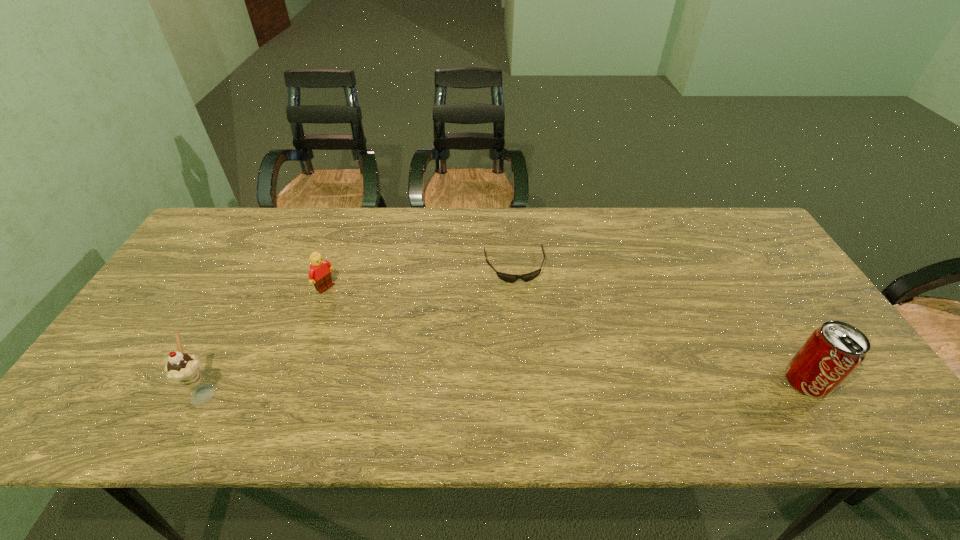
Locate an element on the screen. blank space at the near edge of the desktop is located at coordinates (528, 394).

This screenshot has height=540, width=960. In the image, there is a desktop. Identify the location of free region at the left edge. (154, 336).

The height and width of the screenshot is (540, 960). In order to click on vacant space at the far left corner in this screenshot , I will do `click(232, 241)`.

Locate an element on the screen. This screenshot has width=960, height=540. vacant space at the far right corner of the desktop is located at coordinates (714, 214).

Where is `empty space that is in between the third object from left to right and the rightmost object`? The height and width of the screenshot is (540, 960). empty space that is in between the third object from left to right and the rightmost object is located at coordinates (660, 324).

This screenshot has width=960, height=540. What are the coordinates of `free space between the shortest object and the pop soda` in the screenshot? It's located at (660, 324).

Locate an element on the screen. The width and height of the screenshot is (960, 540). vacant point located between the Lego and the icecream is located at coordinates (266, 339).

This screenshot has height=540, width=960. Find the location of `vacant space that is in between the leftmost object and the third object from left to right`. vacant space that is in between the leftmost object and the third object from left to right is located at coordinates (360, 329).

You are a GUI agent. You are given a task and a screenshot of the screen. Output one action in this format:
    pyautogui.click(x=<x>, y=<y>)
    Task: Click on the unoccupied area between the Lego and the sunglasses
    
    Given the screenshot: What is the action you would take?
    pyautogui.click(x=420, y=277)

Where is `vacant area that lies between the sunglasses and the second object from left to right`? vacant area that lies between the sunglasses and the second object from left to right is located at coordinates (420, 277).